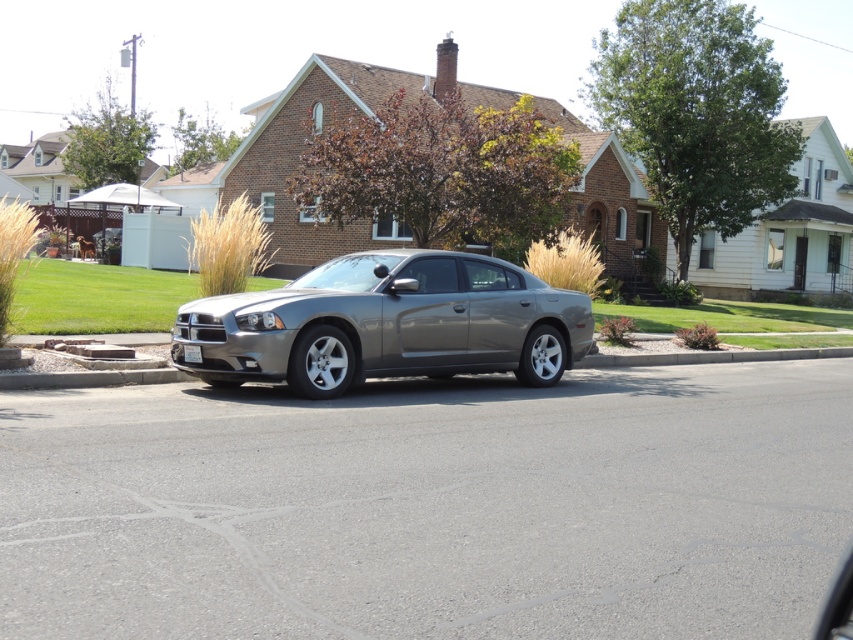
You are a delivery person trying to park your van in the driveway. The van is 2 meters long. The gray asphalt driveway at center is 3 meters long. Is there enough space for your van if you park it behind the white plastic license plate at center?

The gray asphalt driveway at center is 3 meters long and is in front of the white plastic license plate at center. Since the driveway is longer than the van, there is enough space to park the van behind the license plate.

You are standing at the point marked by the coordinates point (430,506). Looking around, you see the gray Dodge Charger parked on the side of the road and the brick house with a sloped roof. Which direction should you walk to reach the gray asphalt driveway at center?

Answer: The gray asphalt driveway at center is located exactly at the point you are standing, so you are already on the gray asphalt driveway at center.

You are a delivery person trying to park your van, which is 2 meters tall, in the space between the gray asphalt driveway at center and the satin metallic sedan at center. Can your van fit vertically between them?

The gray asphalt driveway at center has a lesser height compared to the satin metallic sedan at center. Since the driveway is shorter, the van at 2 meters tall can fit as long as the sedan isn not taller than the driveway. Wait, but the description says the driveway is lesser in height than the sedan. So the sedan is taller. Therefore, the van might not fit if the sedan is taller than 2 meters. Hmm, need to clarify. Wait the question is about fitting between the driveway and the sedan. The vertical space...